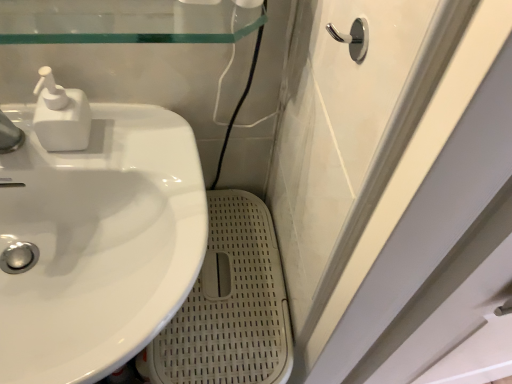
Question: From a real-world perspective, does polished chrome hook at upper right sit lower than white glossy sink at left?

Choices:
 (A) yes
 (B) no

Answer: (B)

Question: Is polished chrome hook at upper right positioned with its back to white glossy sink at left?

Choices:
 (A) no
 (B) yes

Answer: (A)

Question: Is polished chrome hook at upper right positioned before white glossy sink at left?

Choices:
 (A) yes
 (B) no

Answer: (A)

Question: Does polished chrome hook at upper right have a greater width compared to white glossy sink at left?

Choices:
 (A) no
 (B) yes

Answer: (A)

Question: Is polished chrome hook at upper right to the right of white glossy sink at left from the viewer's perspective?

Choices:
 (A) no
 (B) yes

Answer: (B)

Question: Can you confirm if polished chrome hook at upper right is shorter than white glossy sink at left?

Choices:
 (A) yes
 (B) no

Answer: (A)

Question: Does white matte soap dispenser at upper left lie behind polished chrome hook at upper right?

Choices:
 (A) yes
 (B) no

Answer: (A)

Question: From the image's perspective, does white matte soap dispenser at upper left appear lower than polished chrome hook at upper right?

Choices:
 (A) yes
 (B) no

Answer: (A)

Question: Could polished chrome hook at upper right be considered to be inside white matte soap dispenser at upper left?

Choices:
 (A) no
 (B) yes

Answer: (A)

Question: Can you confirm if white matte soap dispenser at upper left is taller than polished chrome hook at upper right?

Choices:
 (A) yes
 (B) no

Answer: (A)

Question: Considering the relative sizes of white matte soap dispenser at upper left and polished chrome hook at upper right in the image provided, is white matte soap dispenser at upper left smaller than polished chrome hook at upper right?

Choices:
 (A) no
 (B) yes

Answer: (A)

Question: From a real-world perspective, is white matte soap dispenser at upper left positioned under polished chrome hook at upper right based on gravity?

Choices:
 (A) yes
 (B) no

Answer: (A)

Question: Is polished chrome hook at upper right in contact with white matte soap dispenser at upper left?

Choices:
 (A) yes
 (B) no

Answer: (B)